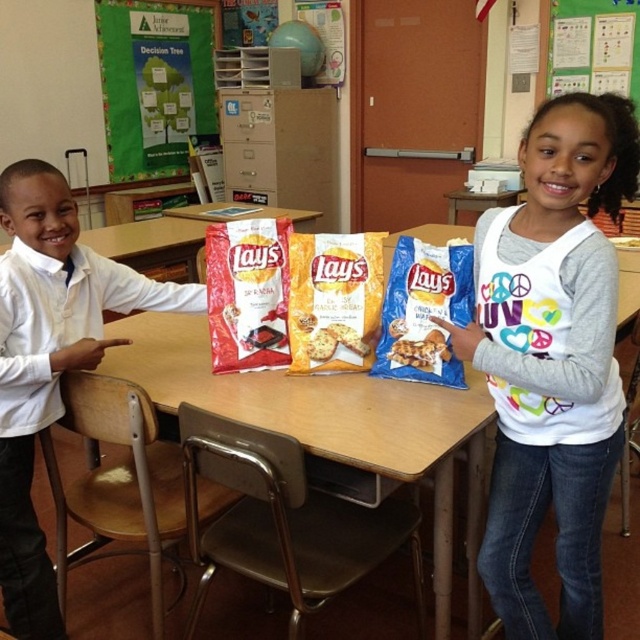
Question: Is the position of wooden table at center less distant than that of green fabric poster at upper left?

Choices:
 (A) yes
 (B) no

Answer: (A)

Question: Can you confirm if white matte shirt at left is thinner than green fabric poster at upper left?

Choices:
 (A) yes
 (B) no

Answer: (A)

Question: Which of the following is the closest to the observer?

Choices:
 (A) green fabric poster at upper left
 (B) wooden table at center
 (C) white soft shirt at upper right
 (D) green paper at upper center

Answer: (C)

Question: Where is white soft shirt at upper right located in relation to wooden table at center in the image?

Choices:
 (A) above
 (B) below

Answer: (A)

Question: Which object is farther from the camera taking this photo?

Choices:
 (A) green fabric poster at upper left
 (B) green paper at upper center
 (C) wooden table at center
 (D) white soft shirt at upper right

Answer: (A)

Question: Among these points, which one is farthest from the camera?

Choices:
 (A) (42, 269)
 (B) (552, 627)
 (C) (570, 26)

Answer: (C)